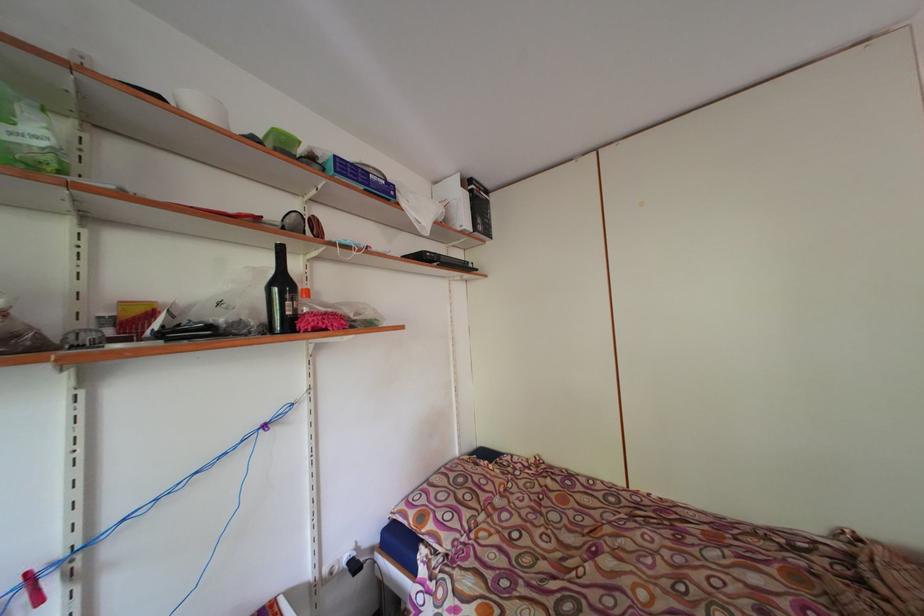
Find where to lift the yellow cardboard box. Please return your answer as a coordinate pair (x, y).

(136, 315)